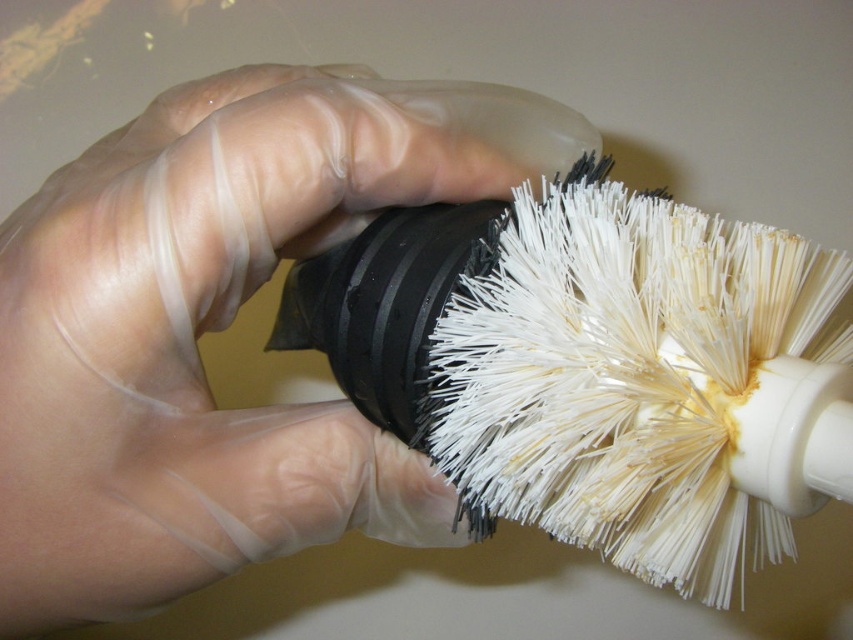
Question: Which object is closer to the camera taking this photo?

Choices:
 (A) transparent plastic glove at center
 (B) white bristle brush at center

Answer: (B)

Question: Is transparent plastic glove at center further to the viewer compared to white bristle brush at center?

Choices:
 (A) yes
 (B) no

Answer: (A)

Question: Is transparent plastic glove at center further to camera compared to white bristle brush at center?

Choices:
 (A) no
 (B) yes

Answer: (B)

Question: Is the position of transparent plastic glove at center more distant than that of white bristle brush at center?

Choices:
 (A) no
 (B) yes

Answer: (B)

Question: Which point is farther from the camera taking this photo?

Choices:
 (A) (776, 461)
 (B) (93, 580)

Answer: (B)

Question: Which point is farther to the camera?

Choices:
 (A) (262, 550)
 (B) (544, 240)

Answer: (A)